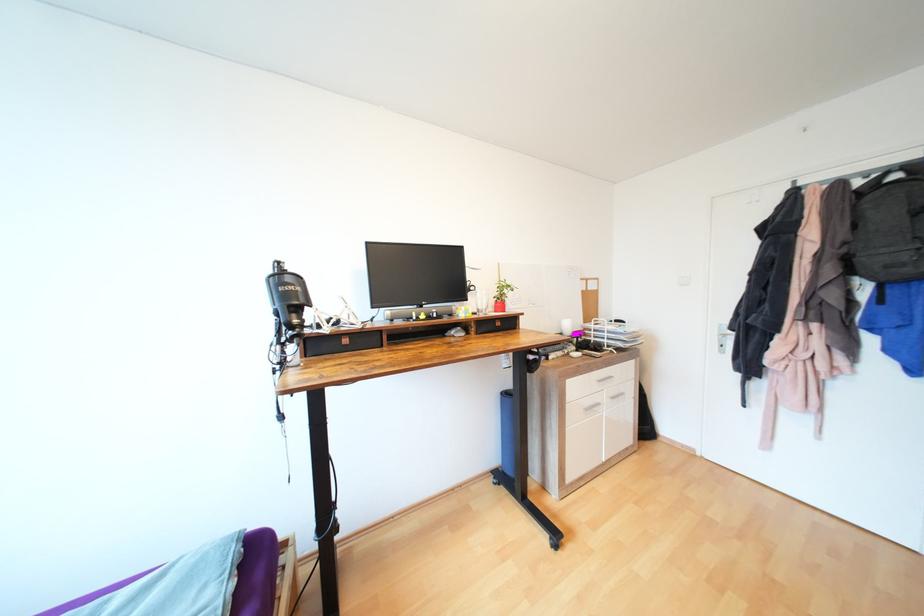
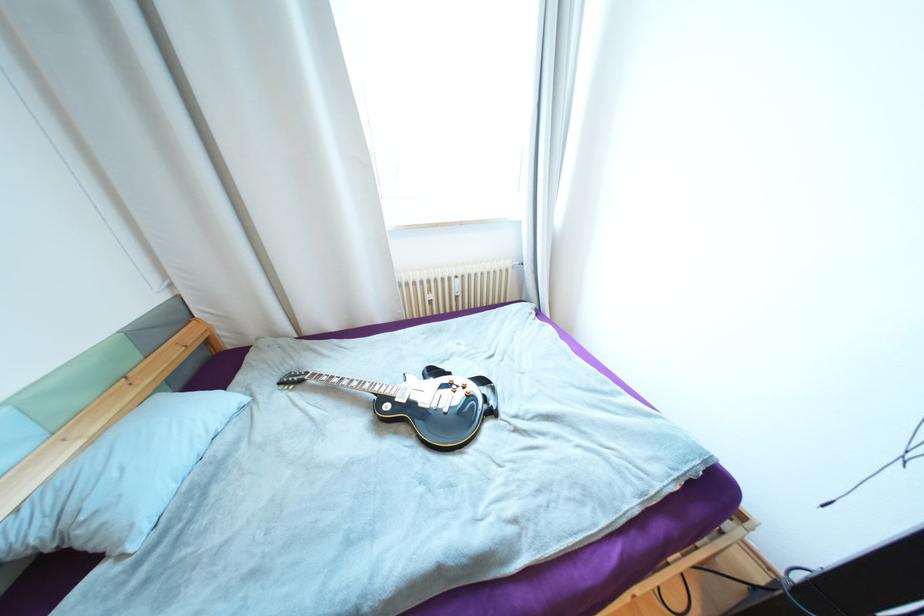
The images are taken continuously from a first-person perspective. In which direction is your viewpoint rotating?

The rotation direction of the camera is left-down.